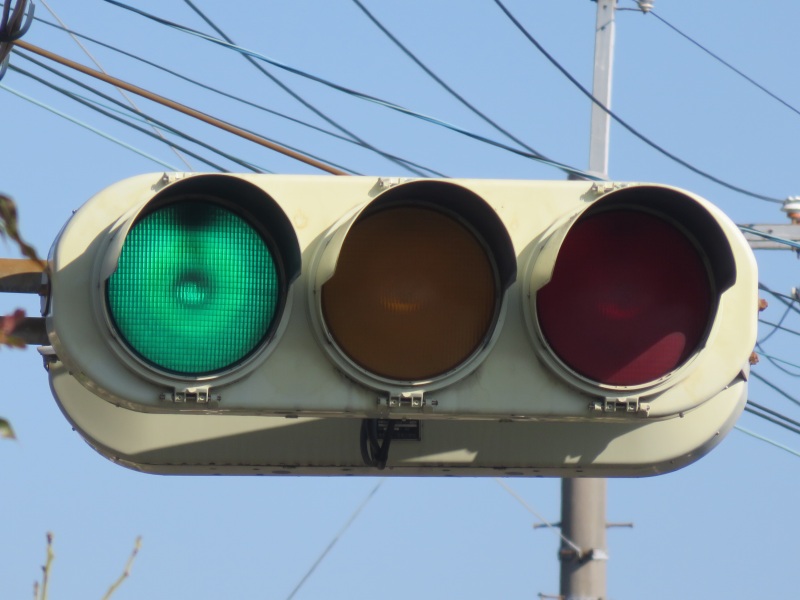
The height and width of the screenshot is (600, 800). Find the location of `circle lights`. circle lights is located at coordinates (209, 294), (382, 293), (674, 290).